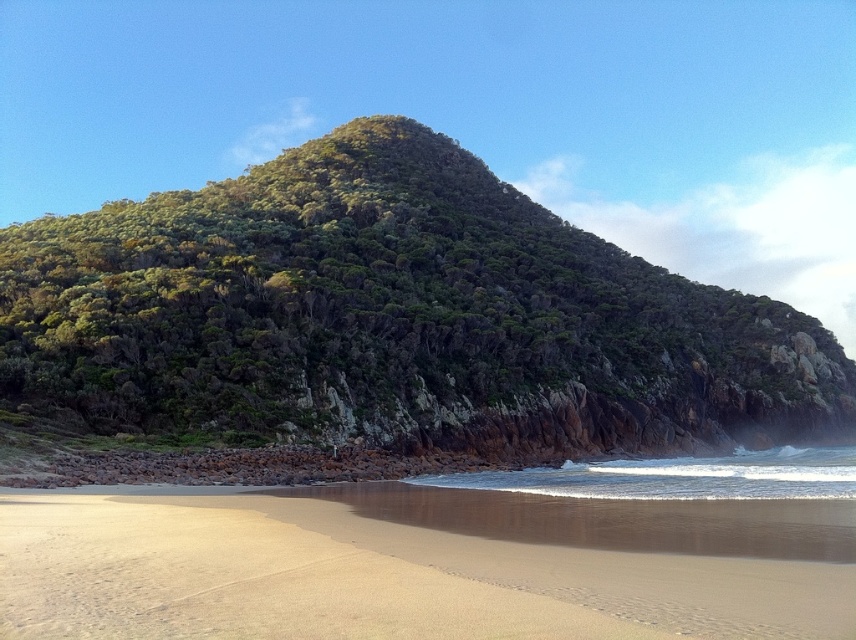
Question: Which of the following is the closest to the observer?

Choices:
 (A) green rocky cliff at center
 (B) white foamy water at lower center
 (C) sandy beach at lower center

Answer: (C)

Question: Considering the relative positions of green rocky cliff at center and sandy beach at lower center in the image provided, where is green rocky cliff at center located with respect to sandy beach at lower center?

Choices:
 (A) right
 (B) left

Answer: (A)

Question: Is sandy beach at lower center wider than white foamy water at lower center?

Choices:
 (A) yes
 (B) no

Answer: (B)

Question: Which point is farther from the camera taking this photo?

Choices:
 (A) (76, 554)
 (B) (328, 230)
 (C) (685, 460)

Answer: (B)

Question: Is sandy beach at lower center thinner than white foamy water at lower center?

Choices:
 (A) no
 (B) yes

Answer: (B)

Question: Considering the real-world distances, which object is farthest from the white foamy water at lower center?

Choices:
 (A) green rocky cliff at center
 (B) sandy beach at lower center

Answer: (A)